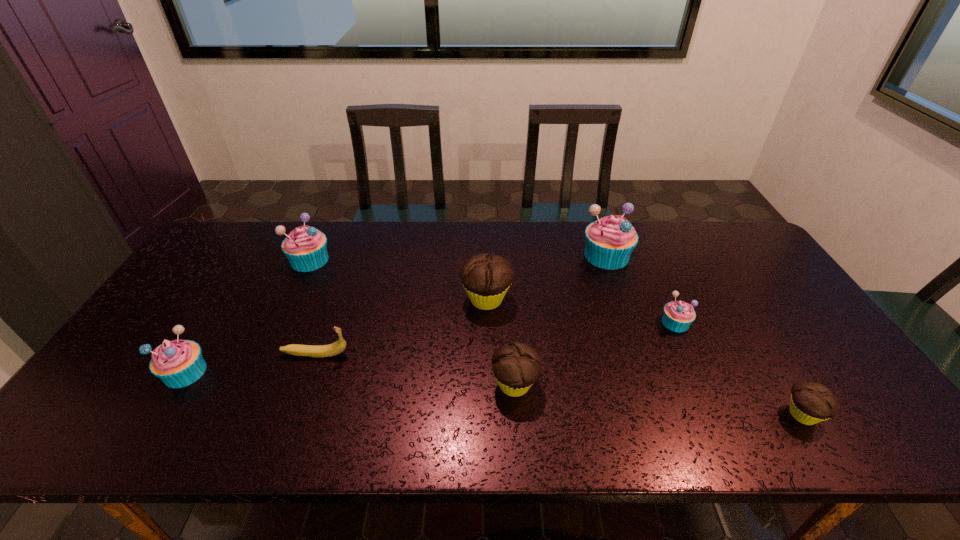
You are a GUI agent. You are given a task and a screenshot of the screen. Output one action in this format:
    pyautogui.click(x=<x>, y=<y>)
    Task: Click on the third object from right to left
    The image size is (960, 540).
    Given the screenshot: What is the action you would take?
    pyautogui.click(x=610, y=240)

The height and width of the screenshot is (540, 960). I want to click on the third muffin from right to left, so click(x=610, y=240).

At what (x,y) coordinates should I click in order to perform the action: click on the third blue muffin from right to left. Please return your answer as a coordinate pair (x, y). Looking at the image, I should click on (305, 247).

Where is `the second muffin from left to right`? the second muffin from left to right is located at coordinates (305, 247).

You are a GUI agent. You are given a task and a screenshot of the screen. Output one action in this format:
    pyautogui.click(x=<x>, y=<y>)
    Task: Click on the biggest chocolate muffin
    The width and height of the screenshot is (960, 540).
    Given the screenshot: What is the action you would take?
    pyautogui.click(x=486, y=278)

I want to click on the leftmost blue muffin, so click(x=178, y=363).

Image resolution: width=960 pixels, height=540 pixels. I want to click on the third biggest blue muffin, so click(178, 363).

I want to click on the second biggest chocolate muffin, so click(x=516, y=366).

Where is `banana`? banana is located at coordinates (339, 346).

Find the location of a particular element. This screenshot has height=540, width=960. the rightmost blue muffin is located at coordinates (678, 315).